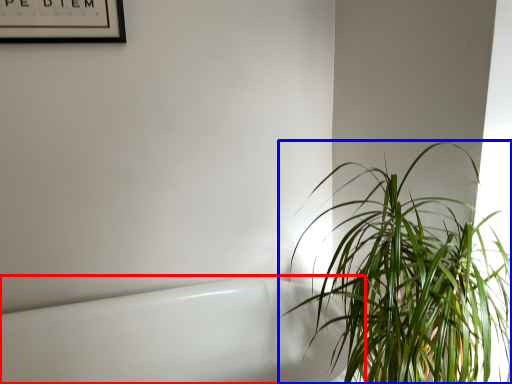
Question: Which object appears closest to the camera in this image, bath (highlighted by a red box) or houseplant (highlighted by a blue box)?

Choices:
 (A) bath
 (B) houseplant

Answer: (B)